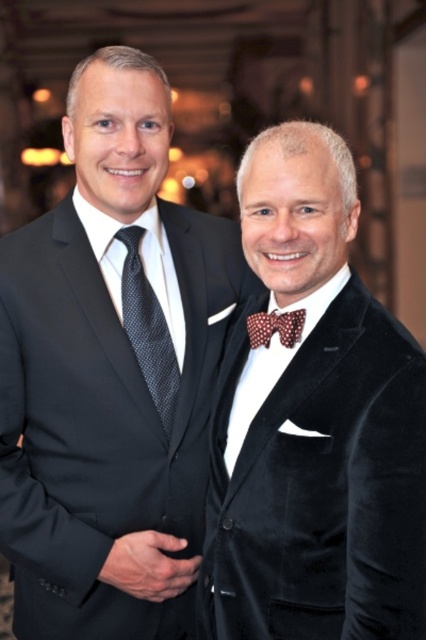
What are the coordinates of the dark gray textured tie at left?

The dark gray textured tie at left is located at coordinates (147, 330).

You are a photographer at a formal event. You want to capture a closeup shot of both the dark gray textured tie at left and the brown dotted bow tie at center. Given that your camera has a minimum focus distance of 10 inches, will you be able to focus on both ties simultaneously?

The dark gray textured tie at left and the brown dotted bow tie at center are 12.60 inches apart from each other. Since the camera has a minimum focus distance of 10 inches, the distance between the two ties is greater than the minimum focus distance, so the camera can focus on both ties simultaneously.